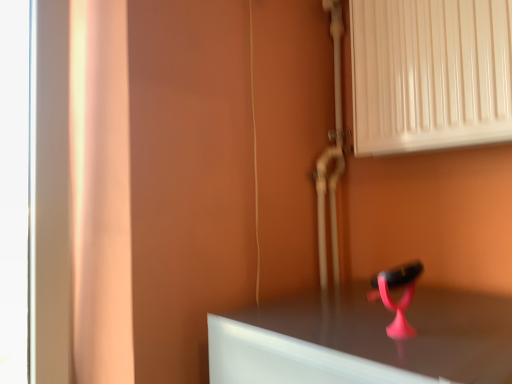
What do you see at coordinates (430, 74) in the screenshot? The image size is (512, 384). I see `white textured radiator at upper right` at bounding box center [430, 74].

Identify the location of white textured radiator at upper right. This screenshot has width=512, height=384. (430, 74).

Identify the location of white textured radiator at upper right. (430, 74).